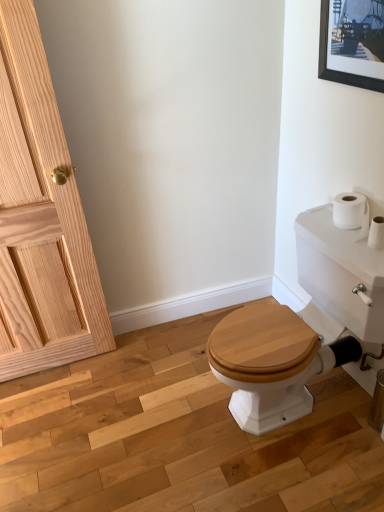
I want to click on vacant area that lies between white glossy porcelain at right and natural wood door at left, so click(x=134, y=396).